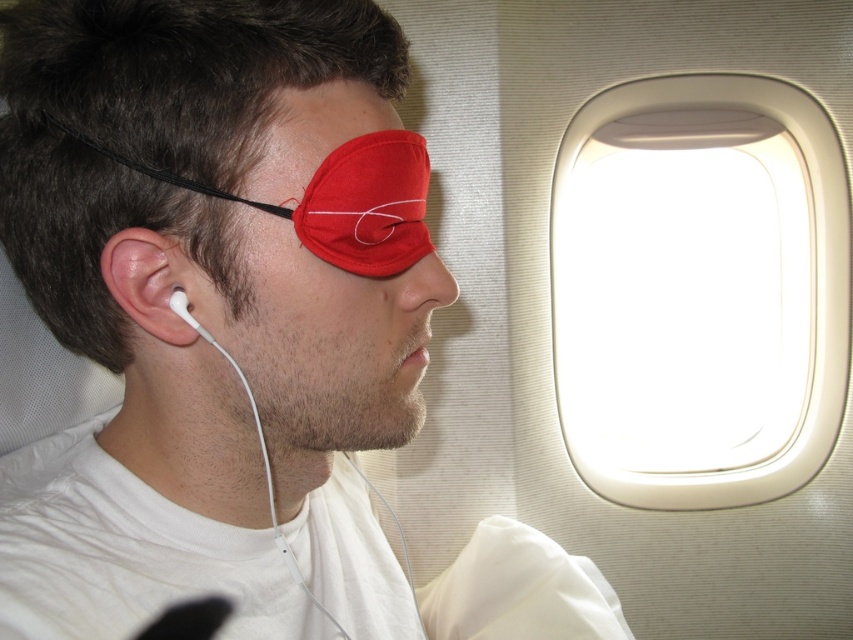
Question: Which of the following is the closest to the observer?

Choices:
 (A) red fabric eye mask at upper left
 (B) white earbud at left
 (C) white plastic airplane window at upper right
 (D) matte fabric eye mask at upper right

Answer: (A)

Question: Can you confirm if matte fabric eye mask at upper right is positioned to the right of white earbud at left?

Choices:
 (A) yes
 (B) no

Answer: (A)

Question: Is white earbud at left wider than white matte earphone at left?

Choices:
 (A) yes
 (B) no

Answer: (A)

Question: Estimate the real-world distances between objects in this image. Which object is closer to the matte fabric eye mask at upper right?

Choices:
 (A) white matte earphone at left
 (B) red fabric eye mask at upper left
 (C) white plastic airplane window at upper right

Answer: (B)

Question: Which point is closer to the camera?

Choices:
 (A) (186, 161)
 (B) (399, 193)
 (C) (676, 355)

Answer: (A)

Question: From the image, what is the correct spatial relationship of white plastic airplane window at upper right in relation to white earbud at left?

Choices:
 (A) right
 (B) left

Answer: (A)